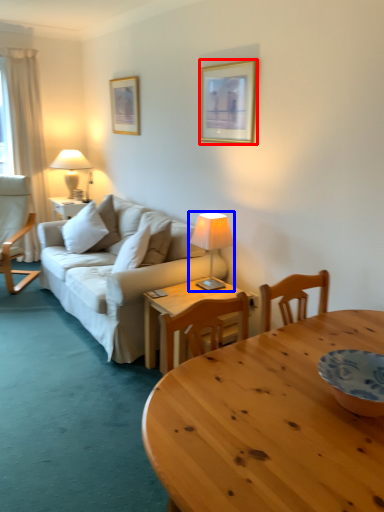
Question: Which point is closer to the camera, picture frame (highlighted by a red box) or lamp (highlighted by a blue box)?

Choices:
 (A) picture frame
 (B) lamp

Answer: (B)